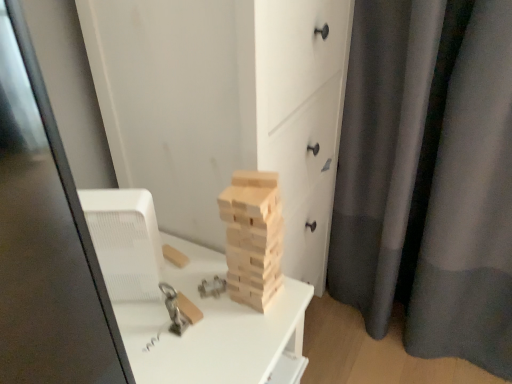
Question: Does wooden blocks at center have a larger size compared to gray matte curtain at right?

Choices:
 (A) no
 (B) yes

Answer: (B)

Question: Are wooden blocks at center and gray matte curtain at right making contact?

Choices:
 (A) no
 (B) yes

Answer: (A)

Question: Is the depth of wooden blocks at center greater than that of gray matte curtain at right?

Choices:
 (A) yes
 (B) no

Answer: (B)

Question: Is wooden blocks at center in front of gray matte curtain at right?

Choices:
 (A) yes
 (B) no

Answer: (A)

Question: From a real-world perspective, is wooden blocks at center located beneath gray matte curtain at right?

Choices:
 (A) no
 (B) yes

Answer: (A)

Question: From the image's perspective, is wooden blocks at center below gray matte curtain at right?

Choices:
 (A) no
 (B) yes

Answer: (B)

Question: Does natural wood blocks at center come in front of gray matte curtain at right?

Choices:
 (A) no
 (B) yes

Answer: (B)

Question: Is natural wood blocks at center not near gray matte curtain at right?

Choices:
 (A) yes
 (B) no

Answer: (B)

Question: Is natural wood blocks at center in contact with gray matte curtain at right?

Choices:
 (A) yes
 (B) no

Answer: (B)

Question: Is natural wood blocks at center aimed at gray matte curtain at right?

Choices:
 (A) yes
 (B) no

Answer: (B)

Question: Does natural wood blocks at center appear on the right side of gray matte curtain at right?

Choices:
 (A) no
 (B) yes

Answer: (A)

Question: Does natural wood blocks at center appear on the left side of gray matte curtain at right?

Choices:
 (A) no
 (B) yes

Answer: (B)

Question: Is natural wood blocks at center aimed at wooden blocks at center?

Choices:
 (A) no
 (B) yes

Answer: (A)